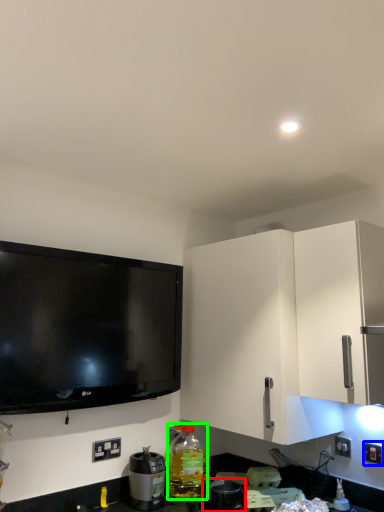
Question: Which object is the closest to the appliance (highlighted by a red box)? Choose among these: electric outlet (highlighted by a blue box) or bottle (highlighted by a green box).

Choices:
 (A) electric outlet
 (B) bottle

Answer: (B)